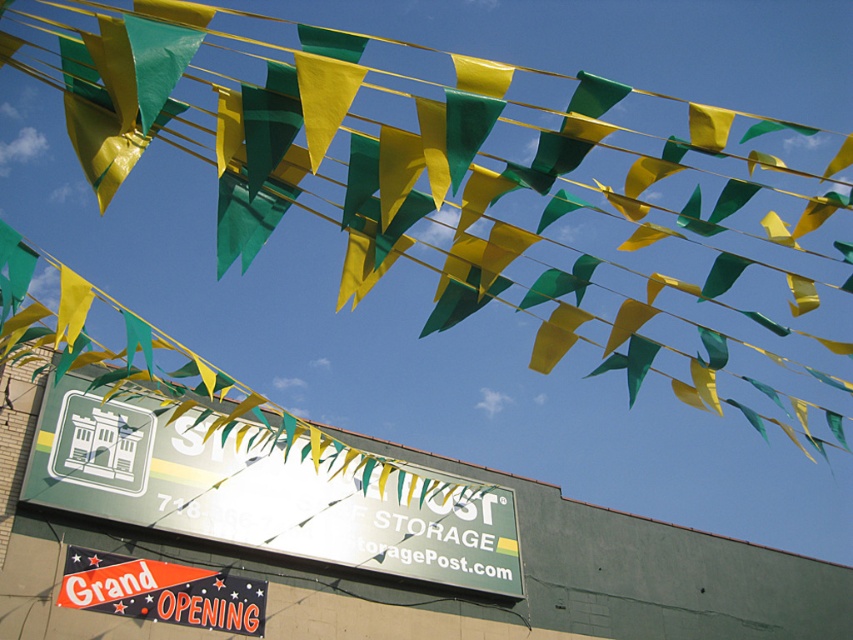
You are standing at the entrance of the storage facility and want to locate the green fabric flag at upper center. According to the coordinates provided, where should you look relative to the image frame?

The green fabric flag at upper center is located at point 0.300 on the x axis and 0.569 on the y axis, which means it is positioned 30.00000000000000000000000000000000000000000000000000000000000000000000000000000000000000000000000000000000000000000000000000000000000000000000000000000000000000000000000000000000000000000000000000000000000000000000000000000000000000000000000000000000000000000000000000000000000000000000000000000000000000000000000000000000000000000000000000000000000000000000000000000000000000000

You are a delivery person standing at the entrance of the storage facility. You need to place a package on the green matte signboard at center. However, there is a green fabric flag at upper center in the way. Can you reach the signboard without touching the flag?

The green fabric flag at upper center is 60.34 feet away from the green matte signboard at center. Since the distance between them is significant, you can safely reach the signboard without touching the flag.